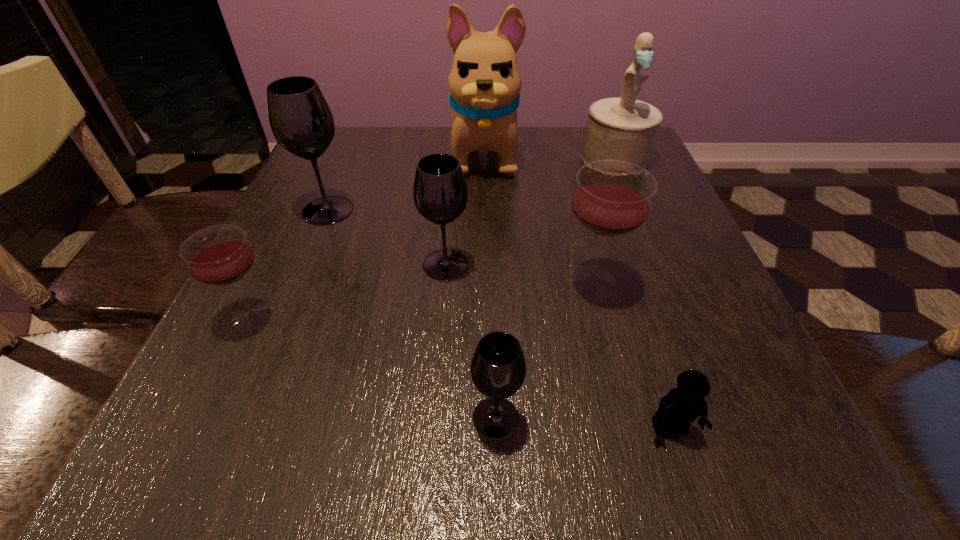
At what (x,y) coordinates should I click in order to perform the action: click on vacant point located between the figurine and the left red wineglass. Please return your answer as a coordinate pair (x, y). The height and width of the screenshot is (540, 960). Looking at the image, I should click on (434, 237).

Image resolution: width=960 pixels, height=540 pixels. In order to click on empty location between the biggest gray wineglass and the figurine in this screenshot , I will do [471, 184].

The image size is (960, 540). In order to click on free space between the second biggest gray wineglass and the tallest object in this screenshot , I will do `click(466, 210)`.

Locate an element on the screen. vacant area that lies between the figurine and the left red wineglass is located at coordinates (434, 237).

This screenshot has height=540, width=960. I want to click on free space that is in between the nearest gray wineglass and the bigger red wineglass, so click(543, 350).

I want to click on vacant area that lies between the leftmost gray wineglass and the figurine, so click(471, 184).

Where is `object identified as the fourth closest to the white figurine`? This screenshot has height=540, width=960. object identified as the fourth closest to the white figurine is located at coordinates (302, 123).

At what (x,y) coordinates should I click in order to perform the action: click on object that stands as the closest to the beige puppy. Please return your answer as a coordinate pair (x, y). Looking at the image, I should click on (622, 128).

The width and height of the screenshot is (960, 540). In order to click on wineglass that is the third closest to the white figurine in this screenshot , I will do `click(302, 123)`.

The height and width of the screenshot is (540, 960). I want to click on wineglass that stands as the third closest to the white figurine, so click(x=302, y=123).